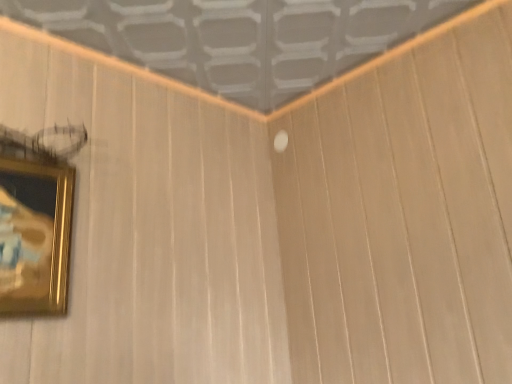
What do you see at coordinates (38, 241) in the screenshot? I see `gold metallic picture frame at lower left` at bounding box center [38, 241].

Where is `gold metallic picture frame at lower left`? The image size is (512, 384). gold metallic picture frame at lower left is located at coordinates (38, 241).

Locate an element on the screen. The image size is (512, 384). gold metallic picture frame at lower left is located at coordinates (38, 241).